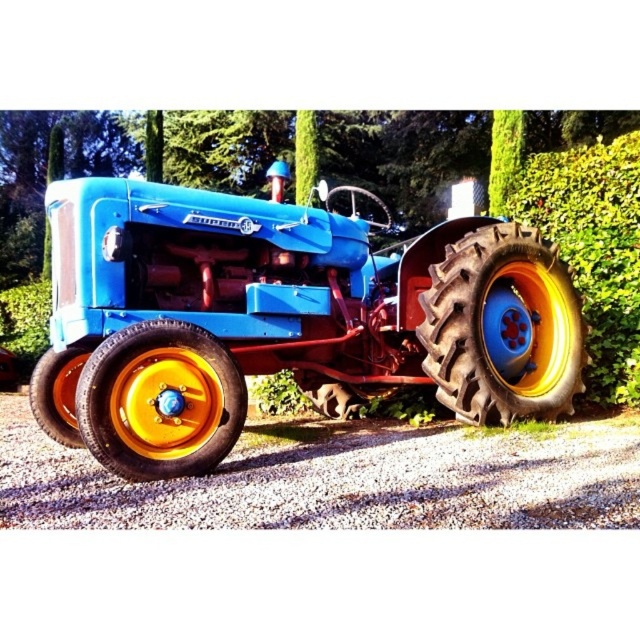
Question: Which object is the farthest from the matte blue tractor at center?

Choices:
 (A) rubber/textured tire at lower left
 (B) rubber/tread tire at center
 (C) gravel at lower center
 (D) rubber/textured tire at center

Answer: (A)

Question: Where is gravel at lower center located in relation to rubber/textured tire at center in the image?

Choices:
 (A) left
 (B) right

Answer: (A)

Question: Does matte blue tractor at center have a smaller size compared to green leafy hedge at right?

Choices:
 (A) yes
 (B) no

Answer: (B)

Question: Which object is positioned closest to the rubber/textured tire at center?

Choices:
 (A) matte blue tractor at center
 (B) rubber/tread tire at center
 (C) green leafy hedge at right

Answer: (A)

Question: Does matte blue tractor at center come in front of gravel at lower center?

Choices:
 (A) yes
 (B) no

Answer: (B)

Question: Which point appears farthest from the camera in this image?

Choices:
 (A) (275, 502)
 (B) (65, 380)
 (C) (472, 266)
 (D) (637, 154)

Answer: (D)